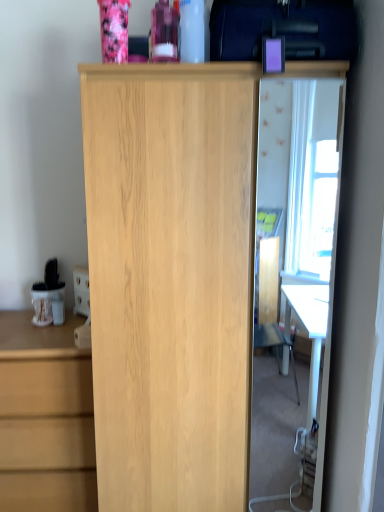
Question: From the image's perspective, is light wood chest of drawers at left above purple plastic case at upper right?

Choices:
 (A) yes
 (B) no

Answer: (B)

Question: From the image's perspective, is light wood chest of drawers at left located beneath purple plastic case at upper right?

Choices:
 (A) no
 (B) yes

Answer: (B)

Question: Does light wood chest of drawers at left have a greater width compared to purple plastic case at upper right?

Choices:
 (A) yes
 (B) no

Answer: (B)

Question: Can you confirm if light wood chest of drawers at left is positioned to the right of purple plastic case at upper right?

Choices:
 (A) yes
 (B) no

Answer: (B)

Question: From a real-world perspective, is light wood chest of drawers at left on purple plastic case at upper right?

Choices:
 (A) yes
 (B) no

Answer: (B)

Question: From the image's perspective, relative to light wood cupboard at center, is transparent glass door at center above or below?

Choices:
 (A) below
 (B) above

Answer: (B)

Question: From a real-world perspective, relative to light wood cupboard at center, is transparent glass door at center vertically above or below?

Choices:
 (A) below
 (B) above

Answer: (B)

Question: In the image, is transparent glass door at center on the left side or the right side of light wood cupboard at center?

Choices:
 (A) right
 (B) left

Answer: (A)

Question: Is transparent glass door at center taller or shorter than light wood cupboard at center?

Choices:
 (A) short
 (B) tall

Answer: (A)

Question: From the image's perspective, is light wood cupboard at center above or below transparent glass door at center?

Choices:
 (A) above
 (B) below

Answer: (B)

Question: Is light wood cupboard at center bigger or smaller than transparent glass door at center?

Choices:
 (A) small
 (B) big

Answer: (B)

Question: Considering their positions, is light wood cupboard at center located in front of or behind transparent glass door at center?

Choices:
 (A) front
 (B) behind

Answer: (A)

Question: Visually, is light wood cupboard at center positioned to the left or to the right of transparent glass door at center?

Choices:
 (A) left
 (B) right

Answer: (A)

Question: Is point 19,486 closer or farther from the camera than point 339,38?

Choices:
 (A) farther
 (B) closer

Answer: (A)

Question: Would you say light wood chest of drawers at left is to the left or to the right of purple plastic case at upper right in the picture?

Choices:
 (A) left
 (B) right

Answer: (A)